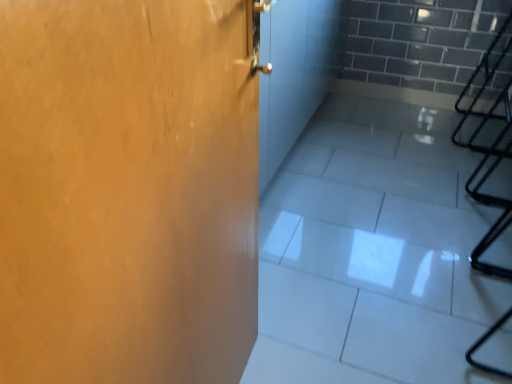
Question: From a real-world perspective, is matte wood door at left above or below white glossy tile at center?

Choices:
 (A) below
 (B) above

Answer: (B)

Question: Is matte wood door at left inside or outside of white glossy tile at center?

Choices:
 (A) outside
 (B) inside

Answer: (A)

Question: Based on their sizes in the image, would you say matte wood door at left is bigger or smaller than white glossy tile at center?

Choices:
 (A) small
 (B) big

Answer: (A)

Question: Is point (281, 274) positioned closer to the camera than point (231, 148)?

Choices:
 (A) farther
 (B) closer

Answer: (A)

Question: Is white glossy tile at center wider or thinner than matte wood door at left?

Choices:
 (A) thin
 (B) wide

Answer: (B)

Question: From a real-world perspective, relative to matte wood door at left, is white glossy tile at center vertically above or below?

Choices:
 (A) above
 (B) below

Answer: (B)

Question: From the image's perspective, is white glossy tile at center above or below matte wood door at left?

Choices:
 (A) above
 (B) below

Answer: (A)